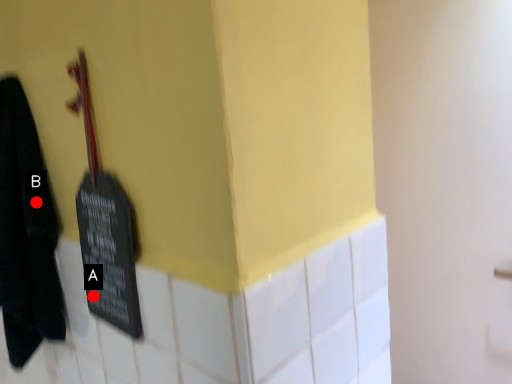
Question: Two points are circled on the image, labeled by A and B beside each circle. Which point appears farthest from the camera in this image?

Choices:
 (A) A is further
 (B) B is further

Answer: (B)